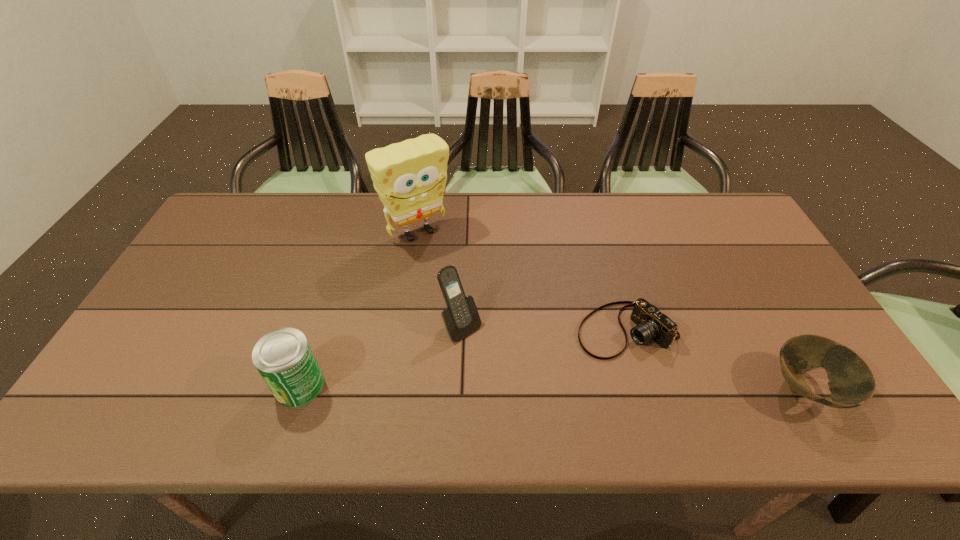
Identify which object is the nearest to the bowl. Please provide its 2D coordinates. Your answer should be formatted as a tuple, i.e. [(x, y)], where the tuple contains the x and y coordinates of a point satisfying the conditions above.

[(651, 324)]

Identify which object is the fourth closest to the farthest object. Please provide its 2D coordinates. Your answer should be formatted as a tuple, i.e. [(x, y)], where the tuple contains the x and y coordinates of a point satisfying the conditions above.

[(851, 382)]

Image resolution: width=960 pixels, height=540 pixels. Find the location of `free spot that satisfies the following two spatial constraints: 1. on the front side of the second tallest object; 2. on the left side of the sponge`. free spot that satisfies the following two spatial constraints: 1. on the front side of the second tallest object; 2. on the left side of the sponge is located at coordinates (403, 327).

In order to click on vacant region that satisfies the following two spatial constraints: 1. on the front side of the sponge; 2. on the right side of the camera in this screenshot , I will do `click(403, 330)`.